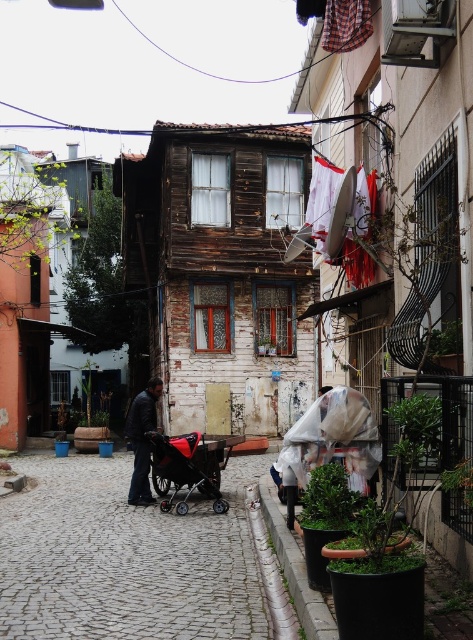
You are a parent pushing the red matte baby carriage at center along the cobblestone street. You notice the dark gray fabric jacket at center hanging from a clothesline above the street. Can you safely pass underneath without the jacket getting caught on the carriage?

The red matte baby carriage at center is closer to the viewer than the dark gray fabric jacket at center, so the jacket is further away. Since the jacket is above and further back, there is enough space between them to pass safely without the jacket getting caught on the carriage.

You are a parent trying to push both the red fabric stroller at center and the red matte baby carriage at center through a narrow alleyway that is only 1 meter wide. Can both items fit side by side without overlapping?

The red fabric stroller at center might be wider than the red matte baby carriage at center, so there is a possibility that they cannot fit side by side within the 1 meter width of the alleyway. It would be safer to push them one at a time.

You are a parent holding a baby and standing on the balcony of the wooden building. You see both the red fabric stroller at center and the red matte baby carriage at center from your vantage point. Which one is closer to you?

The red fabric stroller at center is below the red matte baby carriage at center, so the red matte baby carriage at center is closer to you since it is positioned above the stroller.